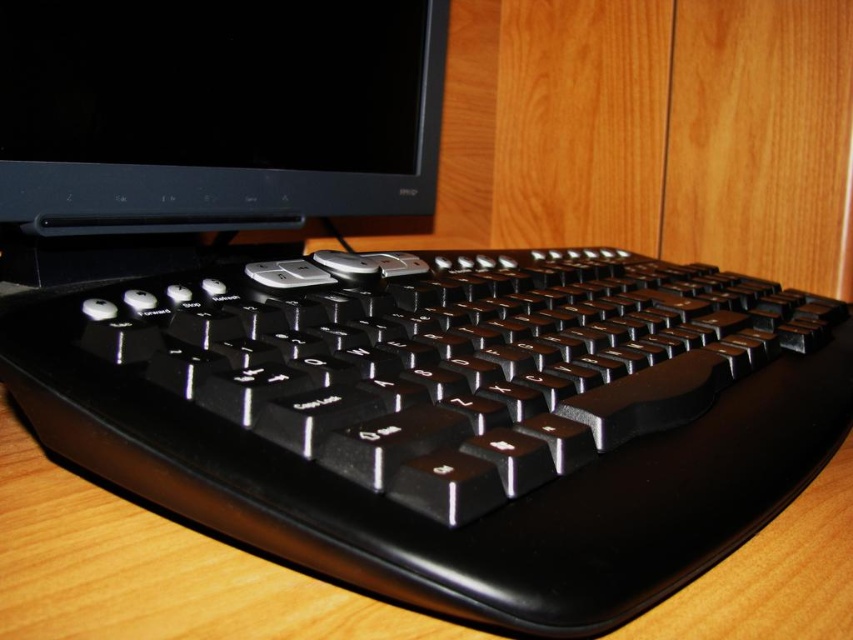
Can you confirm if black plastic keyboard at center is smaller than black glossy monitor at upper left?

Actually, black plastic keyboard at center might be larger than black glossy monitor at upper left.

Is point (674, 387) closer to viewer compared to point (18, 177)?

Yes.

You are a GUI agent. You are given a task and a screenshot of the screen. Output one action in this format:
    pyautogui.click(x=<x>, y=<y>)
    Task: Click on the black plastic keyboard at center
    This screenshot has width=853, height=640.
    Given the screenshot: What is the action you would take?
    pyautogui.click(x=451, y=419)